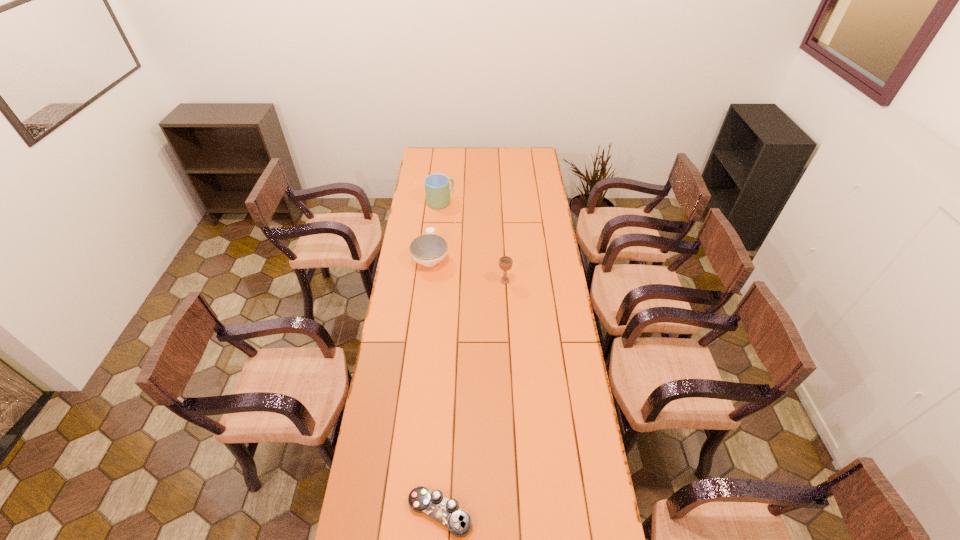
Identify the location of the farthest object. This screenshot has height=540, width=960. (437, 189).

Identify the location of the second nearest object. The width and height of the screenshot is (960, 540). (505, 262).

You are a GUI agent. You are given a task and a screenshot of the screen. Output one action in this format:
    pyautogui.click(x=<x>, y=<y>)
    Task: Click on the rightmost object
    
    Given the screenshot: What is the action you would take?
    pyautogui.click(x=505, y=262)

Where is `the third tallest object`? The height and width of the screenshot is (540, 960). the third tallest object is located at coordinates (429, 249).

Locate an element on the screen. The height and width of the screenshot is (540, 960). chinaware is located at coordinates (429, 249).

Locate an element on the screen. the nearest object is located at coordinates (446, 512).

Find the location of a particular element. The width and height of the screenshot is (960, 540). control is located at coordinates (446, 512).

Image resolution: width=960 pixels, height=540 pixels. I want to click on vacant position located on the front of the farthest object, so click(438, 228).

The image size is (960, 540). Identify the location of free space located 0.080m on the front of the rightmost object. (506, 299).

Find the location of a particular element. This screenshot has height=540, width=960. free space located on the side with the handle of the chinaware is located at coordinates (436, 208).